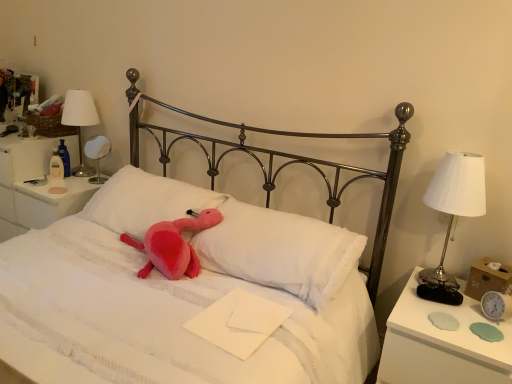
This screenshot has height=384, width=512. I want to click on blank space situated above white fabric lampshade at upper left, the 3th bedside lamp from the right (from a real-world perspective), so click(79, 94).